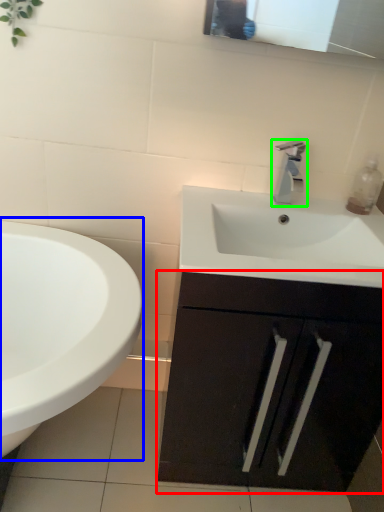
Question: Based on their relative distances, which object is farther from bathroom cabinet (highlighted by a red box)? Choose from sink (highlighted by a blue box) and tap (highlighted by a green box).

Choices:
 (A) sink
 (B) tap

Answer: (B)